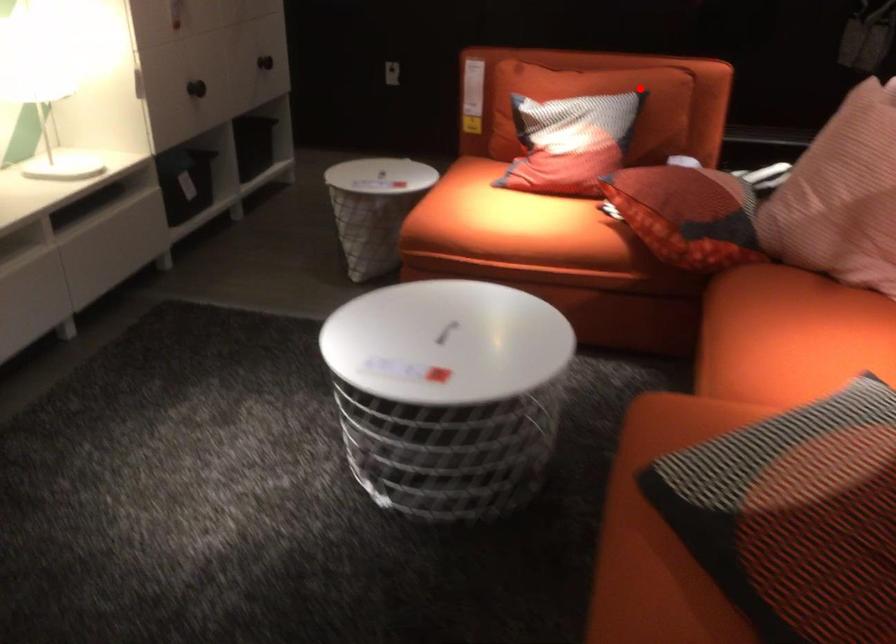
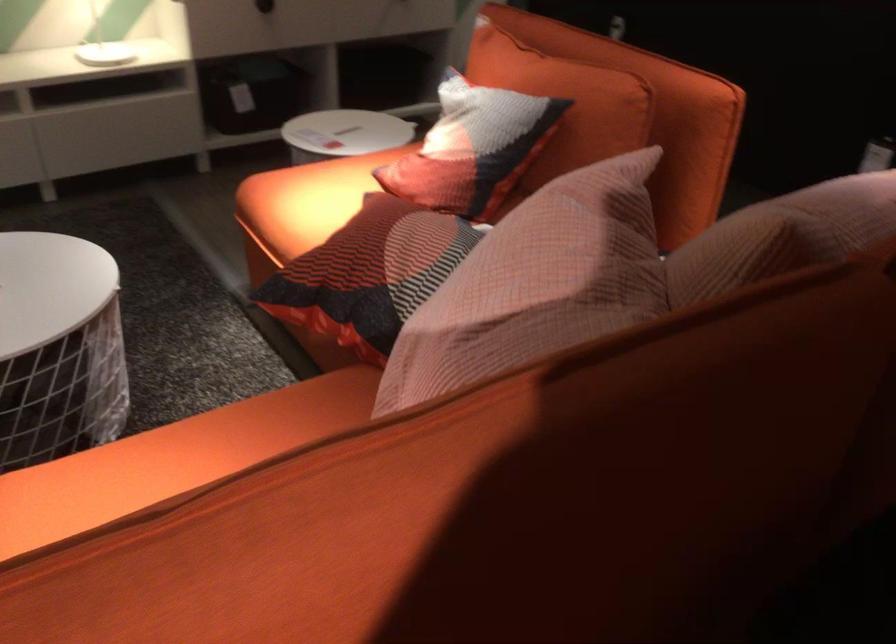
Locate, in the second image, the point that corresponds to the highlighted location in the first image.

(564, 102)